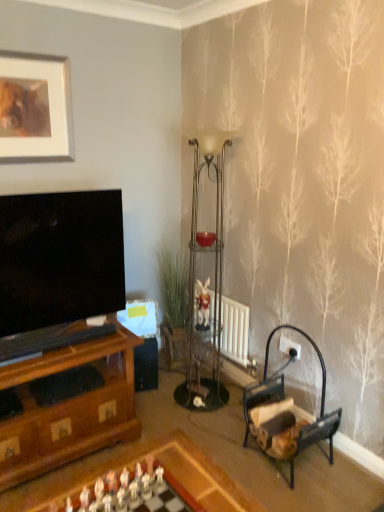
This screenshot has width=384, height=512. I want to click on vacant area situated to the left side of metallic glass side table at center, so click(x=163, y=396).